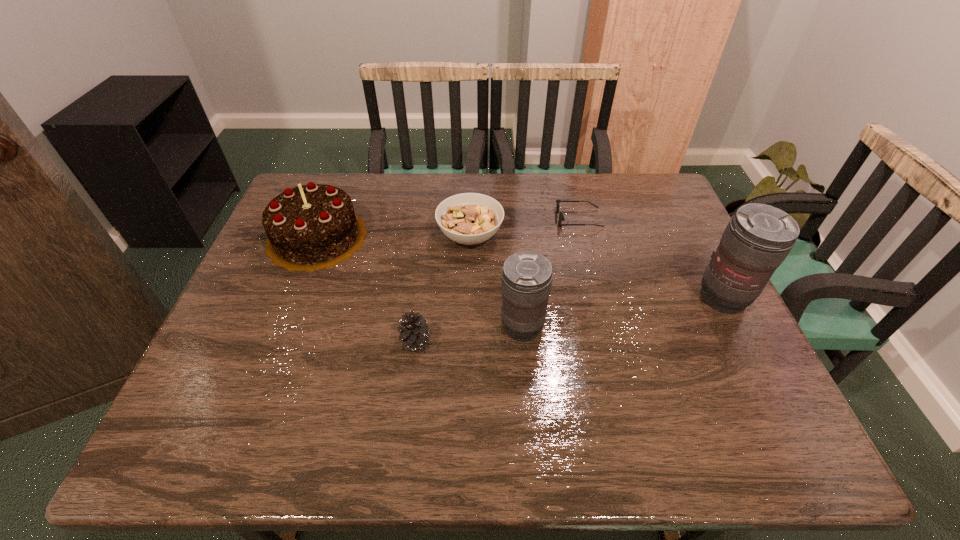
The height and width of the screenshot is (540, 960). I want to click on the left telephoto lens, so click(x=526, y=282).

Image resolution: width=960 pixels, height=540 pixels. I want to click on the rightmost object, so click(x=758, y=238).

Locate an element on the screen. This screenshot has width=960, height=540. the tallest object is located at coordinates (758, 238).

This screenshot has width=960, height=540. In order to click on the leftmost object in this screenshot , I will do 311,227.

At what (x,y) coordinates should I click in order to perform the action: click on stew. Please return your answer as a coordinate pair (x, y). Looking at the image, I should click on (469, 218).

I want to click on sunglasses, so click(x=561, y=217).

The image size is (960, 540). What are the coordinates of `the second object from right to left` in the screenshot? It's located at (561, 217).

Image resolution: width=960 pixels, height=540 pixels. In order to click on pinecone in this screenshot , I will do `click(414, 332)`.

At what (x,y) coordinates should I click in order to perform the action: click on blank area located 0.200m on the side of the shorter telephoto lens where the control switches are located. Please return your answer as a coordinate pair (x, y). Looking at the image, I should click on (416, 327).

You are a GUI agent. You are given a task and a screenshot of the screen. Output one action in this format:
    pyautogui.click(x=<x>, y=<y>)
    Task: Click on the free space located on the side of the shorter telephoto lens where the control switches are located
    The height and width of the screenshot is (540, 960).
    Given the screenshot: What is the action you would take?
    pyautogui.click(x=337, y=327)